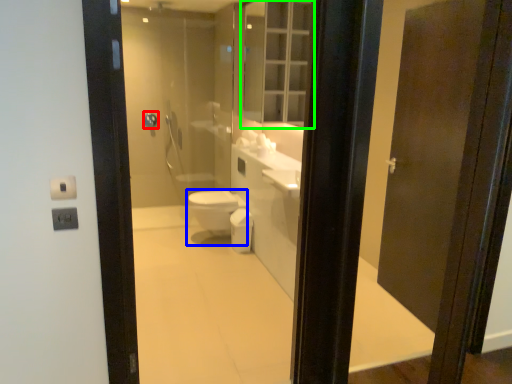
Question: Estimate the real-world distances between objects in this image. Which object is farther from towel bar (highlighted by a red box), bidet (highlighted by a blue box) or medicine cabinet (highlighted by a green box)?

Choices:
 (A) bidet
 (B) medicine cabinet

Answer: (B)